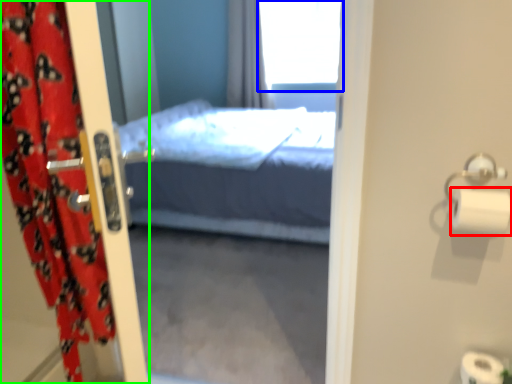
Question: Which object is the closest to the toilet paper (highlighted by a red box)? Choose among these: window (highlighted by a blue box) or curtain (highlighted by a green box).

Choices:
 (A) window
 (B) curtain

Answer: (B)